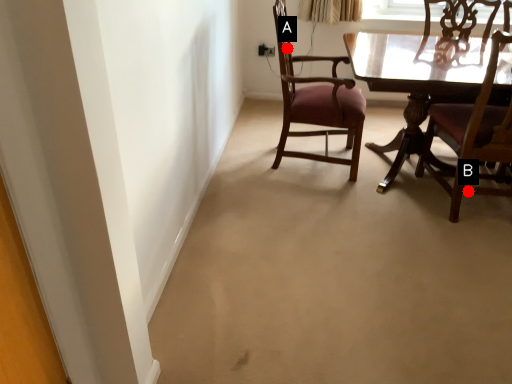
Question: Two points are circled on the image, labeled by A and B beside each circle. Which point is closer to the camera?

Choices:
 (A) A is closer
 (B) B is closer

Answer: (B)